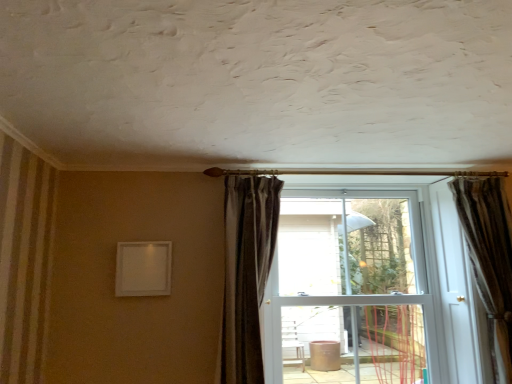
The image size is (512, 384). What do you see at coordinates (369, 276) in the screenshot?
I see `white glossy door at center` at bounding box center [369, 276].

The image size is (512, 384). Identify the location of brown textured curtain at right, the 1th curtain viewed from the right. (490, 259).

Considering the relative positions of dark brown velvet curtain at center, the second curtain when ordered from right to left, and white glossy door at center in the image provided, is dark brown velvet curtain at center, the second curtain when ordered from right to left, in front of white glossy door at center?

That is True.

Does dark brown velvet curtain at center, arranged as the first curtain when viewed from the left, touch white glossy door at center?

No, dark brown velvet curtain at center, arranged as the first curtain when viewed from the left, is not touching white glossy door at center.

Considering the relative positions of dark brown velvet curtain at center, the second curtain when ordered from right to left, and white glossy door at center in the image provided, is dark brown velvet curtain at center, the second curtain when ordered from right to left, to the right of white glossy door at center from the viewer's perspective?

In fact, dark brown velvet curtain at center, the second curtain when ordered from right to left, is to the left of white glossy door at center.

From a real-world perspective, is dark brown velvet curtain at center, arranged as the first curtain when viewed from the left, positioned above or below white glossy door at center?

From a real-world perspective, dark brown velvet curtain at center, arranged as the first curtain when viewed from the left, is physically above white glossy door at center.

Is point (452, 320) more distant than point (510, 248)?

Yes, it is.

From a real-world perspective, is white glossy door at center physically located above or below brown textured curtain at right, the 1th curtain viewed from the right?

white glossy door at center is below brown textured curtain at right, the 1th curtain viewed from the right.

Is white glossy door at center at the left side of brown textured curtain at right, the 1th curtain viewed from the right?

Yes, white glossy door at center is to the left of brown textured curtain at right, the 1th curtain viewed from the right.

Looking at their sizes, would you say white glossy door at center is wider or thinner than brown textured curtain at right, the 1th curtain viewed from the right?

In the image, white glossy door at center appears to be wider than brown textured curtain at right, the 1th curtain viewed from the right.

What's the angular difference between white glossy door at center and dark brown velvet curtain at center, arranged as the first curtain when viewed from the left,'s facing directions?

There is a 99.2-degree angle between the facing directions of white glossy door at center and dark brown velvet curtain at center, arranged as the first curtain when viewed from the left.

Between white glossy door at center and dark brown velvet curtain at center, arranged as the first curtain when viewed from the left, which one has smaller size?

With smaller size is dark brown velvet curtain at center, arranged as the first curtain when viewed from the left.

Considering the sizes of objects white glossy door at center and dark brown velvet curtain at center, the second curtain when ordered from right to left, in the image provided, who is taller, white glossy door at center or dark brown velvet curtain at center, the second curtain when ordered from right to left,?

white glossy door at center.

This screenshot has width=512, height=384. What are the coordinates of `the 2nd curtain positioned above the white glossy door at center (from the image's perspective)` in the screenshot? It's located at (247, 272).

From a real-world perspective, which is physically below, brown textured curtain at right, the 1th curtain viewed from the right, or dark brown velvet curtain at center, arranged as the first curtain when viewed from the left?

In real-world perspective, brown textured curtain at right, the 1th curtain viewed from the right, is lower.

Which is behind, brown textured curtain at right, positioned as the 2th curtain in left-to-right order, or dark brown velvet curtain at center, arranged as the first curtain when viewed from the left?

brown textured curtain at right, positioned as the 2th curtain in left-to-right order, is further from the camera.

From the image's perspective, which object appears higher, brown textured curtain at right, the 1th curtain viewed from the right, or dark brown velvet curtain at center, the second curtain when ordered from right to left?

dark brown velvet curtain at center, the second curtain when ordered from right to left.

Is brown textured curtain at right, the 1th curtain viewed from the right, far away from dark brown velvet curtain at center, arranged as the first curtain when viewed from the left?

Yes, brown textured curtain at right, the 1th curtain viewed from the right, and dark brown velvet curtain at center, arranged as the first curtain when viewed from the left, are quite far apart.

Does brown textured curtain at right, positioned as the 2th curtain in left-to-right order, turn towards white glossy door at center?

No, brown textured curtain at right, positioned as the 2th curtain in left-to-right order, is not oriented towards white glossy door at center.

Who is smaller, brown textured curtain at right, positioned as the 2th curtain in left-to-right order, or white glossy door at center?

brown textured curtain at right, positioned as the 2th curtain in left-to-right order, is smaller.

Which curtain is the 1st one when counting from the front of the white glossy door at center? Please provide its 2D coordinates.

[(490, 259)]

From a real-world perspective, is brown textured curtain at right, the 1th curtain viewed from the right, above or below white glossy door at center?

Clearly, from a real-world perspective, brown textured curtain at right, the 1th curtain viewed from the right, is above white glossy door at center.

Which of these two, dark brown velvet curtain at center, the second curtain when ordered from right to left, or brown textured curtain at right, positioned as the 2th curtain in left-to-right order, is bigger?

Bigger between the two is dark brown velvet curtain at center, the second curtain when ordered from right to left.

Image resolution: width=512 pixels, height=384 pixels. What are the coordinates of `curtain located above the brown textured curtain at right, the 1th curtain viewed from the right (from the image's perspective)` in the screenshot? It's located at (247, 272).

Is dark brown velvet curtain at center, the second curtain when ordered from right to left, positioned before brown textured curtain at right, positioned as the 2th curtain in left-to-right order?

Yes, dark brown velvet curtain at center, the second curtain when ordered from right to left, is closer to the viewer.

Between point (229, 369) and point (494, 381), which one is positioned behind?

The point (494, 381) is more distant.

Image resolution: width=512 pixels, height=384 pixels. I want to click on the 2nd curtain in front when counting from the white glossy door at center, so pyautogui.click(x=247, y=272).

Locate an element on the screen. This screenshot has height=384, width=512. the 1st curtain above the white glossy door at center (from the image's perspective) is located at coordinates (490, 259).

Based on their spatial positions, is dark brown velvet curtain at center, arranged as the first curtain when viewed from the left, or white glossy door at center further from brown textured curtain at right, positioned as the 2th curtain in left-to-right order?

dark brown velvet curtain at center, arranged as the first curtain when viewed from the left, lies further to brown textured curtain at right, positioned as the 2th curtain in left-to-right order, than the other object.

Looking at this image, which object lies nearer to the anchor point white glossy door at center, dark brown velvet curtain at center, the second curtain when ordered from right to left, or brown textured curtain at right, the 1th curtain viewed from the right?

The object closer to white glossy door at center is brown textured curtain at right, the 1th curtain viewed from the right.

Estimate the real-world distances between objects in this image. Which object is closer to dark brown velvet curtain at center, arranged as the first curtain when viewed from the left, brown textured curtain at right, positioned as the 2th curtain in left-to-right order, or white glossy door at center?

Among the two, white glossy door at center is located nearer to dark brown velvet curtain at center, arranged as the first curtain when viewed from the left.

From the image, which object appears to be nearer to brown textured curtain at right, positioned as the 2th curtain in left-to-right order, white glossy door at center or dark brown velvet curtain at center, arranged as the first curtain when viewed from the left?

white glossy door at center.

Considering their positions, is brown textured curtain at right, positioned as the 2th curtain in left-to-right order, positioned closer to white glossy door at center than dark brown velvet curtain at center, arranged as the first curtain when viewed from the left?

The object closer to white glossy door at center is brown textured curtain at right, positioned as the 2th curtain in left-to-right order.

Based on their spatial positions, is white glossy door at center or brown textured curtain at right, the 1th curtain viewed from the right, further from dark brown velvet curtain at center, the second curtain when ordered from right to left?

brown textured curtain at right, the 1th curtain viewed from the right, is positioned further to the anchor dark brown velvet curtain at center, the second curtain when ordered from right to left.

Find the location of a particular element. This screenshot has height=384, width=512. door between dark brown velvet curtain at center, the second curtain when ordered from right to left, and brown textured curtain at right, the 1th curtain viewed from the right, in the horizontal direction is located at coordinates [x=369, y=276].